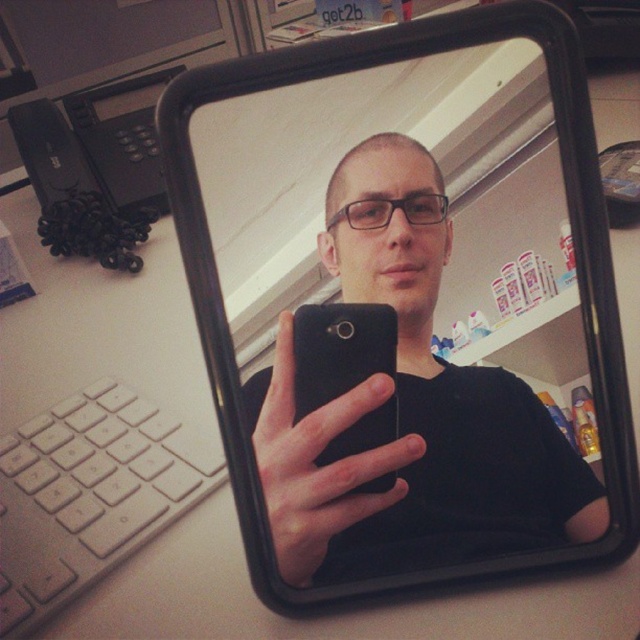
Does black plastic view mirror at center have a greater height compared to black matte smartphone at center?

Yes, black plastic view mirror at center is taller than black matte smartphone at center.

Is black plastic view mirror at center behind black matte smartphone at center?

No, it is not.

Locate an element on the screen. The width and height of the screenshot is (640, 640). black plastic view mirror at center is located at coordinates (406, 304).

You are a GUI agent. You are given a task and a screenshot of the screen. Output one action in this format:
    pyautogui.click(x=<x>, y=<y>)
    Task: Click on the black plastic view mirror at center
    
    Given the screenshot: What is the action you would take?
    pyautogui.click(x=406, y=304)